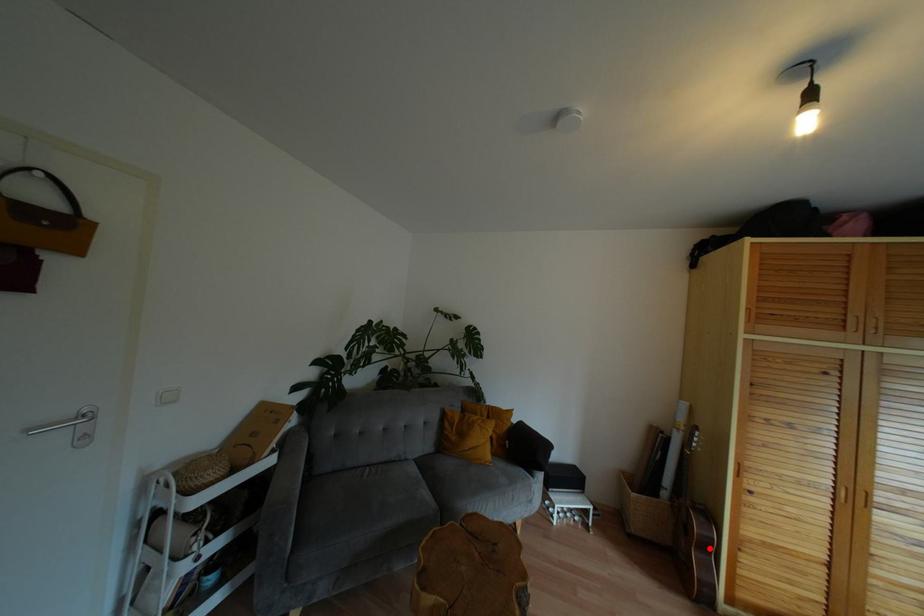
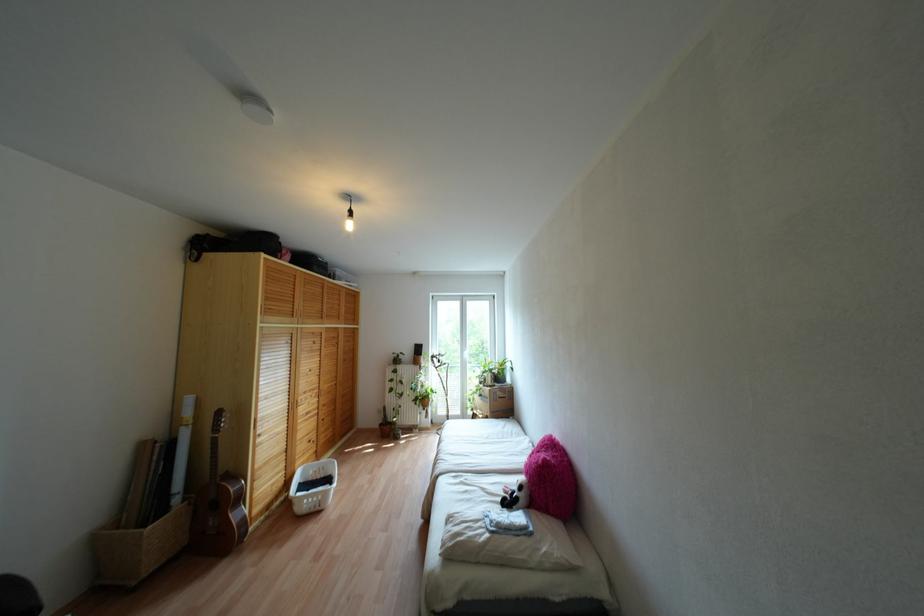
The point at the highlighted location is marked in the first image. Where is the corresponding point in the second image?

(238, 498)